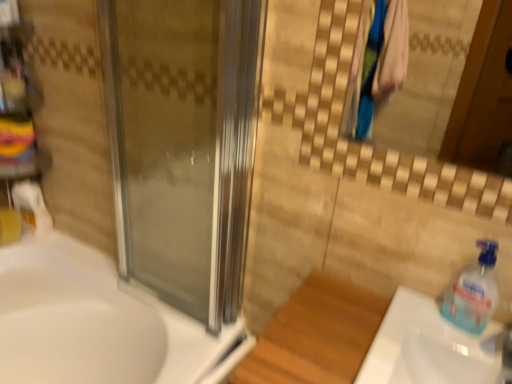
Question: Considering the relative sizes of transparent glass screen door at center and transparent plastic soap dispenser at right in the image provided, is transparent glass screen door at center thinner than transparent plastic soap dispenser at right?

Choices:
 (A) yes
 (B) no

Answer: (B)

Question: Does transparent glass screen door at center have a smaller size compared to transparent plastic soap dispenser at right?

Choices:
 (A) no
 (B) yes

Answer: (A)

Question: Can you confirm if transparent glass screen door at center is positioned to the left of transparent plastic soap dispenser at right?

Choices:
 (A) no
 (B) yes

Answer: (B)

Question: Is transparent glass screen door at center further to camera compared to transparent plastic soap dispenser at right?

Choices:
 (A) yes
 (B) no

Answer: (A)

Question: Does transparent glass screen door at center have a greater height compared to transparent plastic soap dispenser at right?

Choices:
 (A) yes
 (B) no

Answer: (A)

Question: Based on their sizes in the image, would you say white glossy sink at lower right, the second sink in the back-to-front sequence, is bigger or smaller than white glossy sink at lower left, marked as the 1th sink in a back-to-front arrangement?

Choices:
 (A) big
 (B) small

Answer: (B)

Question: From a real-world perspective, is white glossy sink at lower right, the second sink in the back-to-front sequence, physically located above or below white glossy sink at lower left, which is the second sink from front to back?

Choices:
 (A) below
 (B) above

Answer: (B)

Question: Is point tap(367, 355) positioned closer to the camera than point tap(17, 314)?

Choices:
 (A) farther
 (B) closer

Answer: (B)

Question: Is white glossy sink at lower right, which is counted as the 2th sink, starting from the left, inside or outside of white glossy sink at lower left, marked as the 1th sink in a back-to-front arrangement?

Choices:
 (A) inside
 (B) outside

Answer: (B)

Question: Considering the positions of transparent plastic soap dispenser at right and transparent glass screen door at center in the image, is transparent plastic soap dispenser at right bigger or smaller than transparent glass screen door at center?

Choices:
 (A) small
 (B) big

Answer: (A)

Question: Considering the positions of point (479, 327) and point (160, 87), is point (479, 327) closer or farther from the camera than point (160, 87)?

Choices:
 (A) closer
 (B) farther

Answer: (A)

Question: Is transparent plastic soap dispenser at right wider or thinner than transparent glass screen door at center?

Choices:
 (A) wide
 (B) thin

Answer: (B)

Question: From a real-world perspective, is transparent plastic soap dispenser at right above or below transparent glass screen door at center?

Choices:
 (A) below
 (B) above

Answer: (A)

Question: Would you say white glossy sink at lower right, which is counted as the 2th sink, starting from the left, is inside or outside transparent plastic soap dispenser at right?

Choices:
 (A) outside
 (B) inside

Answer: (A)

Question: In terms of height, does white glossy sink at lower right, the 1th sink in the right-to-left sequence, look taller or shorter compared to transparent plastic soap dispenser at right?

Choices:
 (A) tall
 (B) short

Answer: (B)